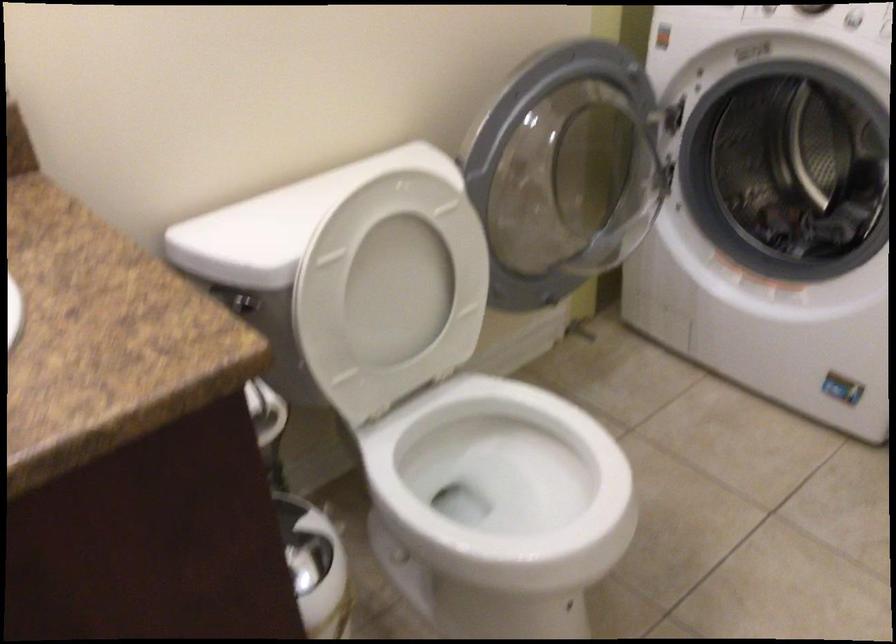
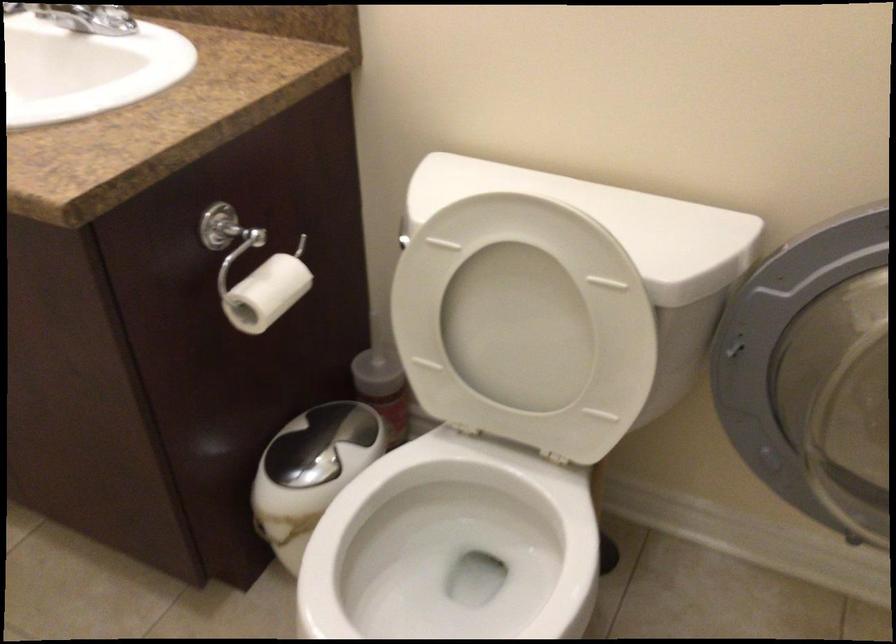
Find the pixel in the second image that matches the point at 242,395 in the first image.

(263, 286)